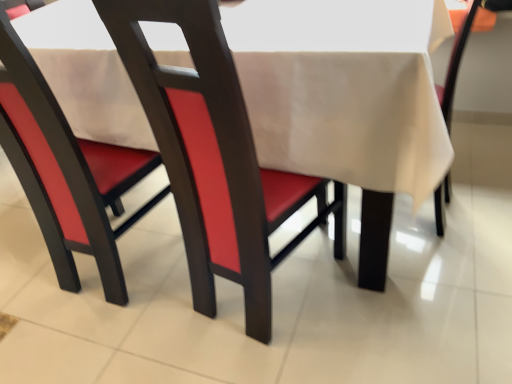
You are a GUI agent. You are given a task and a screenshot of the screen. Output one action in this format:
    pyautogui.click(x=<x>, y=<y>)
    Task: Click on the vacant space that is to the left of matte wood chair at center, arranged as the second chair when viewed from the left
    This screenshot has width=512, height=384.
    Given the screenshot: What is the action you would take?
    pyautogui.click(x=153, y=321)